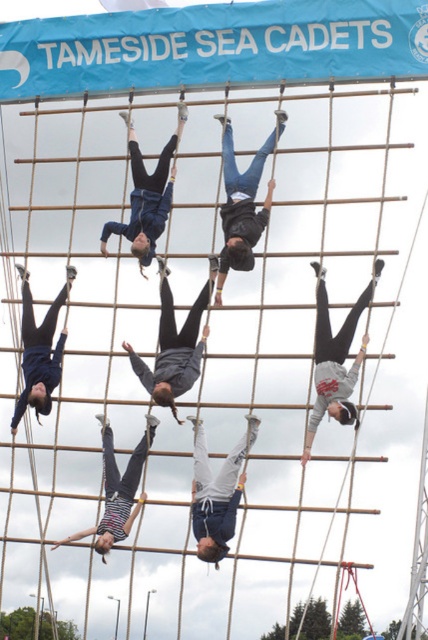
Can you confirm if matte black pants at left is bigger than striped fabric pants at center?

No.

Is point (51, 356) in front of point (95, 547)?

No, (51, 356) is behind (95, 547).

Find the location of a particular element. Image resolution: width=428 pixels, height=640 pixels. matte black pants at left is located at coordinates (39, 349).

Does dark blue sweatshirt at upper center have a larger size compared to matte black pants at left?

Indeed, dark blue sweatshirt at upper center has a larger size compared to matte black pants at left.

Is point (139, 260) more distant than point (59, 349)?

No, (139, 260) is in front of (59, 349).

The height and width of the screenshot is (640, 428). Describe the element at coordinates (146, 195) in the screenshot. I see `dark blue sweatshirt at upper center` at that location.

The width and height of the screenshot is (428, 640). Identify the location of dark blue sweatshirt at upper center. (146, 195).

Which is more to the left, dark gray hoodie at center or matte black pants at left?

matte black pants at left

The width and height of the screenshot is (428, 640). Describe the element at coordinates (175, 344) in the screenshot. I see `dark gray hoodie at center` at that location.

This screenshot has width=428, height=640. Find the location of `dark gray hoodie at center`. dark gray hoodie at center is located at coordinates (175, 344).